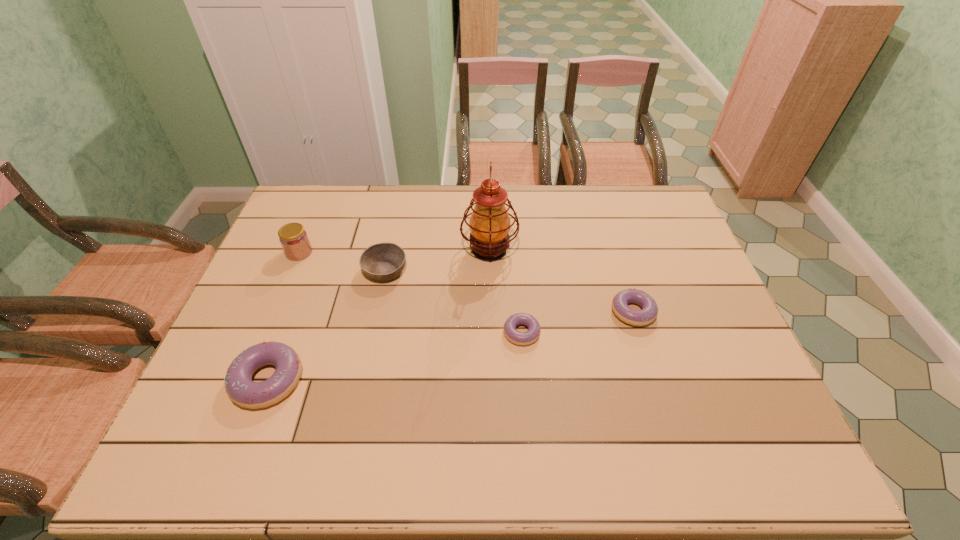
The image size is (960, 540). What are the coordinates of `vacant region located on the right of the shortest doughnut` in the screenshot? It's located at (600, 333).

I want to click on vacant space located 0.100m on the left of the second tallest doughnut, so click(575, 312).

Locate an element on the screen. This screenshot has width=960, height=540. blank space located 0.260m on the front of the jam is located at coordinates (268, 328).

I want to click on blank space located 0.160m on the left of the tallest object, so click(x=411, y=250).

I want to click on free region located on the left of the bowl, so click(x=307, y=271).

Where is `object at the near edge`? Image resolution: width=960 pixels, height=540 pixels. object at the near edge is located at coordinates (240, 388).

Where is `doughnut present at the left edge`? The image size is (960, 540). doughnut present at the left edge is located at coordinates (240, 388).

Locate an element on the screen. jam at the left edge is located at coordinates (294, 240).

This screenshot has height=540, width=960. In order to click on object that is at the near left corner in this screenshot , I will do `click(240, 388)`.

The width and height of the screenshot is (960, 540). I want to click on free space at the far edge, so click(x=568, y=197).